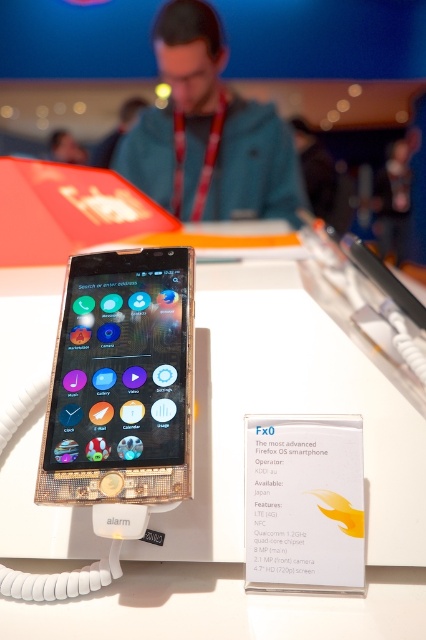
You are at a tech exhibition and see the white glossy table at center and the matte blue jacket at upper center. Which object is nearer to you?

The white glossy table at center is closer to the viewer than the matte blue jacket at upper center.

You are at a tech exhibition and see the smartphone mounted on a stand with a coiled white cable attached. You want to place a promotional flyer on the table where the smartphone is displayed. Where exactly should you place the flyer on the white glossy table at center?

You should place the flyer at point [242,477] on the white glossy table at center as that is the exact coordinate where the table is located.

You are a tech journalist at a tech event. You see the white glossy table at center and the matte blue jacket at upper center. Which object is positioned higher from the ground?

The matte blue jacket at upper center is positioned higher from the ground than the white glossy table at center because the white glossy table at center is below the matte blue jacket at upper center.